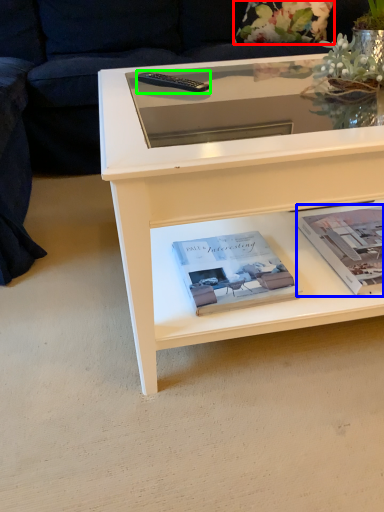
Question: Which object is positioned closest to flower (highlighted by a red box)? Select from paperback book (highlighted by a blue box) and remote (highlighted by a green box).

Choices:
 (A) paperback book
 (B) remote

Answer: (B)